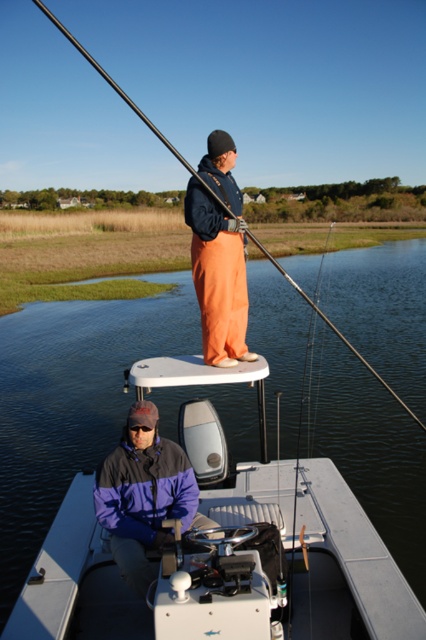
Can you confirm if purple fleece jacket at lower center is shorter than orange cotton pants at center?

Yes.

The height and width of the screenshot is (640, 426). What are the coordinates of `purple fleece jacket at lower center` in the screenshot? It's located at (143, 493).

Where is `purple fleece jacket at lower center`? The height and width of the screenshot is (640, 426). purple fleece jacket at lower center is located at coordinates (143, 493).

Is point (23, 566) positioned before point (198, 248)?

No, it is behind (198, 248).

Is clear water at center bigger than orange cotton pants at center?

Yes, clear water at center is bigger than orange cotton pants at center.

Measure the distance between clear water at center and camera.

They are 4.49 meters apart.

You are a GUI agent. You are given a task and a screenshot of the screen. Output one action in this format:
    pyautogui.click(x=<x>, y=<y>)
    Task: Click on the clear water at center
    This screenshot has height=640, width=426.
    Given the screenshot: What is the action you would take?
    pyautogui.click(x=71, y=397)

Does clear water at center lie behind black rod at upper center?

That is True.

Can you confirm if clear water at center is thinner than black rod at upper center?

Incorrect, clear water at center's width is not less than black rod at upper center's.

Describe the element at coordinates (71, 397) in the screenshot. The image size is (426, 640). I see `clear water at center` at that location.

I want to click on clear water at center, so click(x=71, y=397).